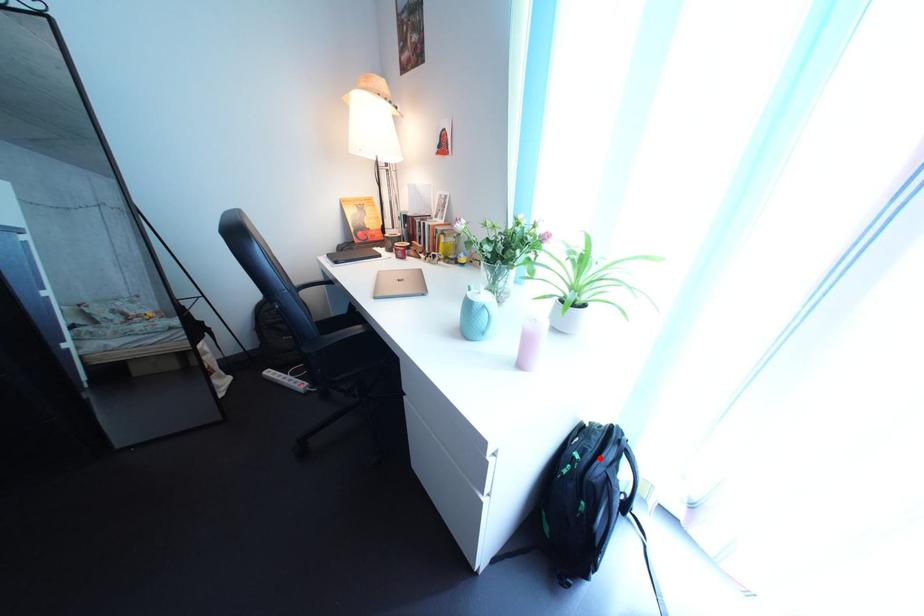
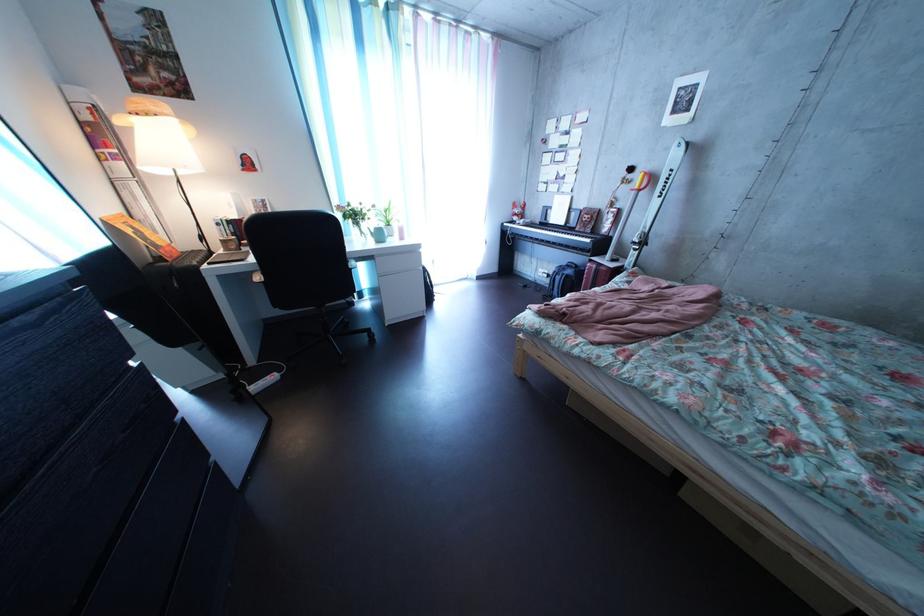
Question: I am providing you with two images of the same scene from different viewpoints. A red point is marked on the first image. Can you still see the location of the red point in image 2?

Choices:
 (A) Yes
 (B) No

Answer: (B)